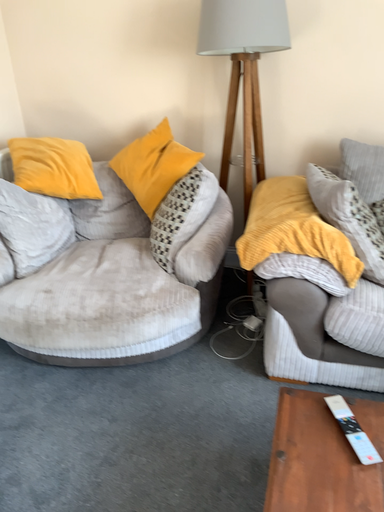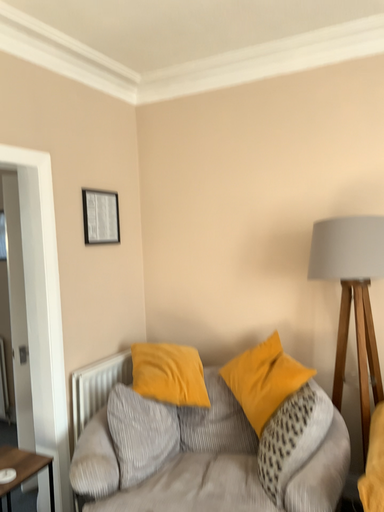
Question: Which way did the camera rotate in the video?

Choices:
 (A) rotated downward
 (B) rotated upward

Answer: (B)